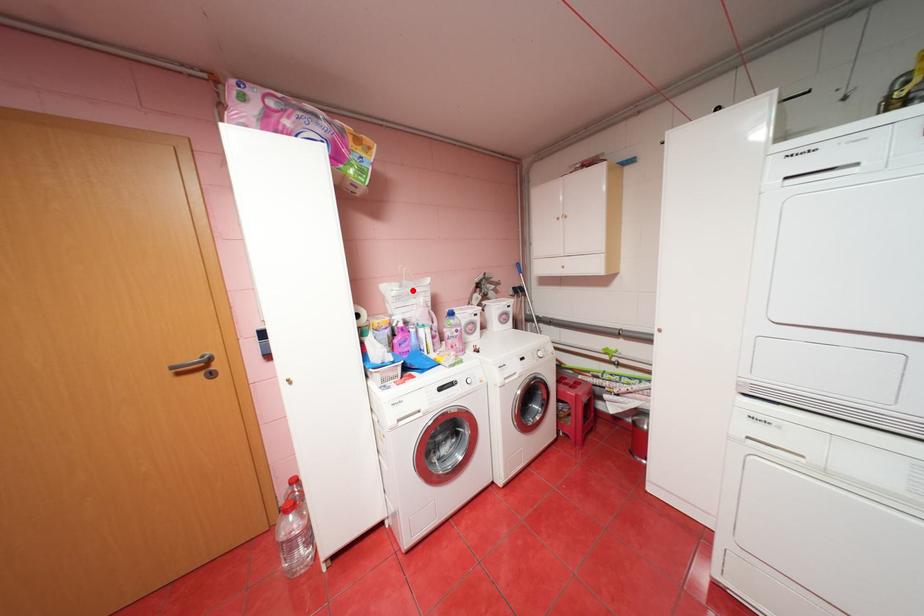
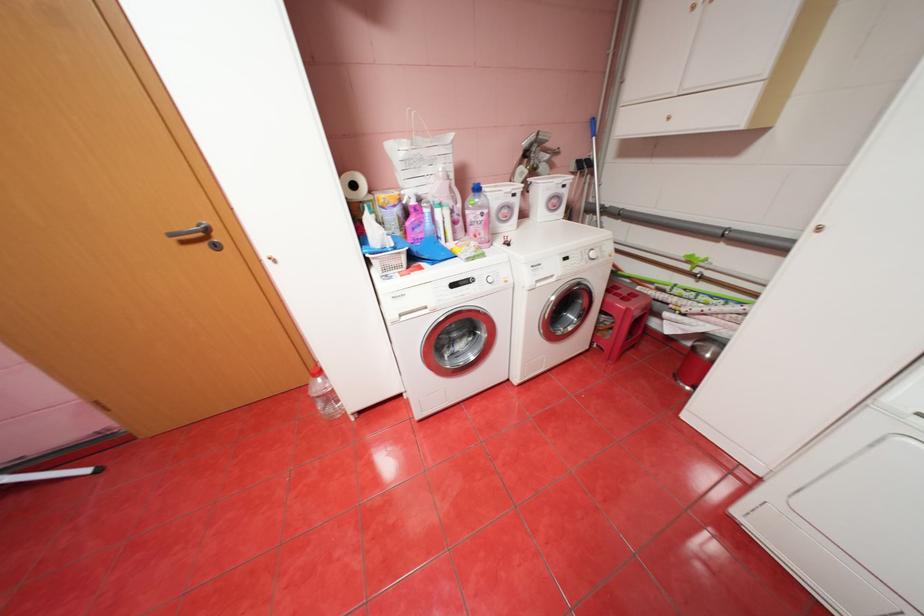
The point at the highlighted location is marked in the first image. Where is the corresponding point in the second image?

(423, 151)